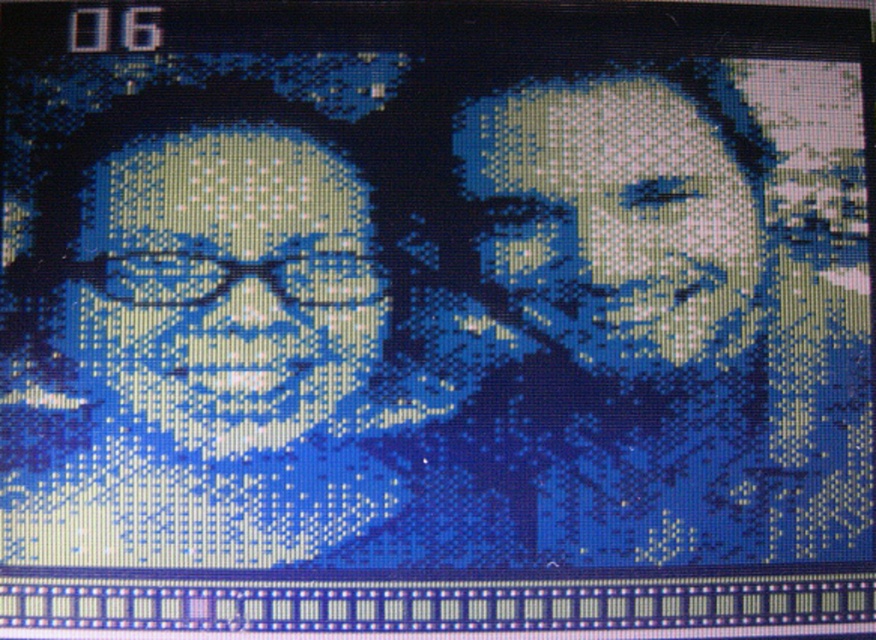
Question: Does matte blue face at right have a lesser width compared to matte blue face at left?

Choices:
 (A) yes
 (B) no

Answer: (A)

Question: Does matte blue face at right appear over matte blue face at left?

Choices:
 (A) yes
 (B) no

Answer: (A)

Question: Can you confirm if matte blue face at right is positioned below matte blue face at left?

Choices:
 (A) no
 (B) yes

Answer: (A)

Question: Which point appears farthest from the camera in this image?

Choices:
 (A) (167, 289)
 (B) (599, 285)

Answer: (B)

Question: Among these points, which one is farthest from the camera?

Choices:
 (A) (152, 355)
 (B) (683, 204)

Answer: (B)